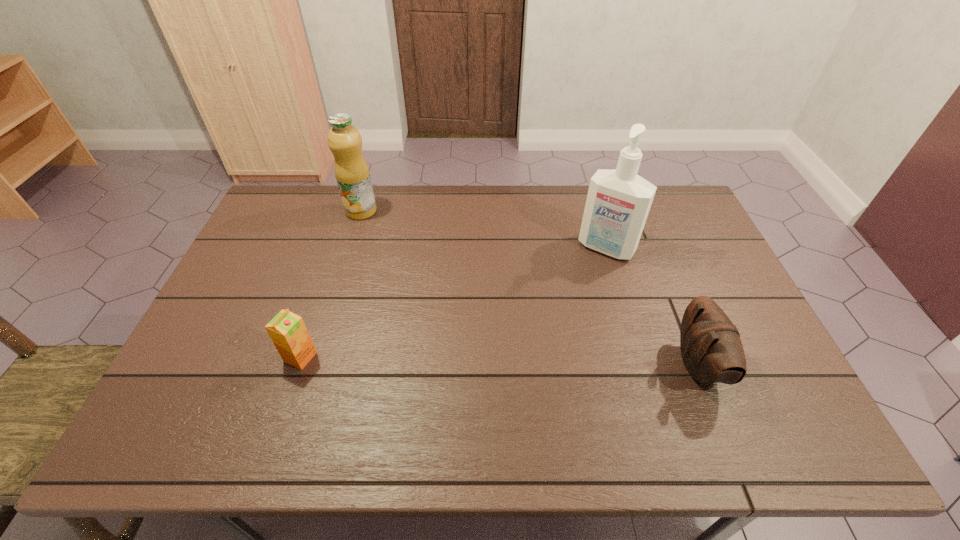
Locate an element on the screen. vacant space on the desktop that is between the orange juice and the pouch and is positioned on the front label of the third shortest object is located at coordinates (447, 360).

You are a GUI agent. You are given a task and a screenshot of the screen. Output one action in this format:
    pyautogui.click(x=<x>, y=<y>)
    Task: Click on the vacant space on the desktop that is between the orange juice and the rightmost object and is positioned on the front label of the tallest object
    This screenshot has height=540, width=960.
    Given the screenshot: What is the action you would take?
    pyautogui.click(x=533, y=362)